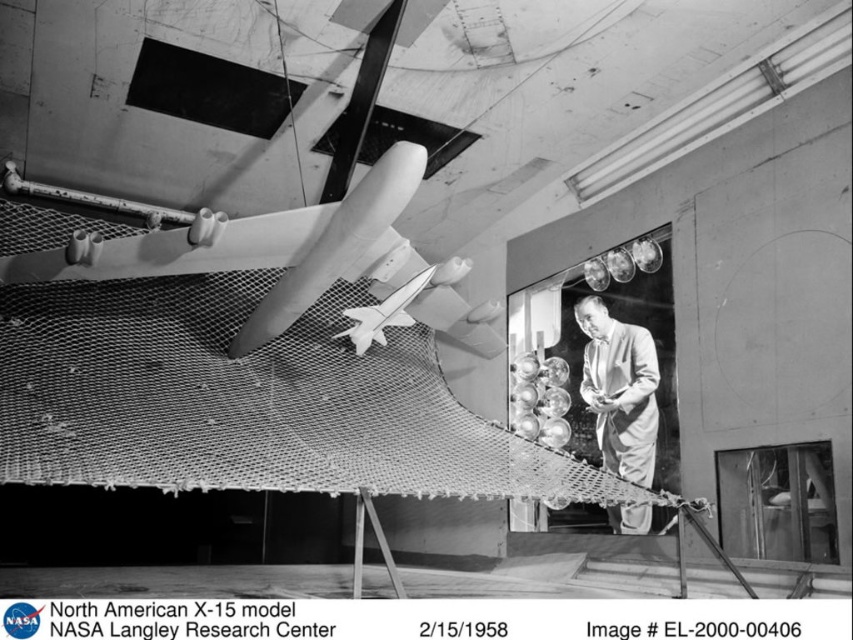
Question: Does smooth white airplane at center appear on the left side of light gray suit at center?

Choices:
 (A) yes
 (B) no

Answer: (A)

Question: Among these objects, which one is farthest from the camera?

Choices:
 (A) smooth white airplane at center
 (B) light gray suit at center

Answer: (B)

Question: Which point appears closest to the camera in this image?

Choices:
 (A) (607, 467)
 (B) (93, 268)

Answer: (B)

Question: Observing the image, what is the correct spatial positioning of smooth white airplane at center in reference to light gray suit at center?

Choices:
 (A) above
 (B) below

Answer: (A)

Question: Can you confirm if smooth white airplane at center is positioned to the right of light gray suit at center?

Choices:
 (A) no
 (B) yes

Answer: (A)